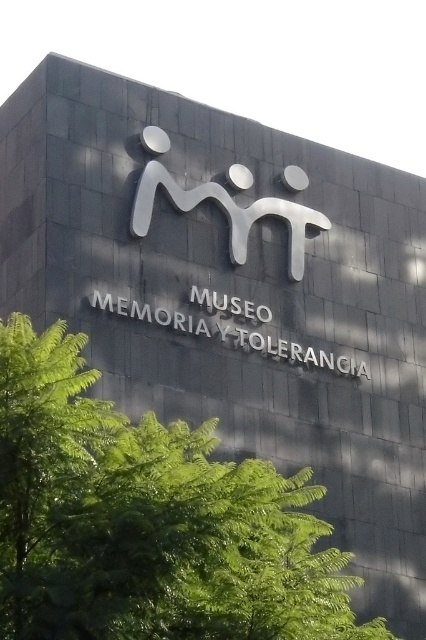
You are standing in front of the building and notice two points marked on the facade. The first point is at coordinates point (137, 518) and the second is at point (137, 221). Which point is closer to you?

Point (137, 518) is closer to the viewer than point (137, 221).

You are a photographer planning to take a picture of the sleek silver logo at center and the green leafy tree at center. Based on the scene, which object is wider?

The green leafy tree at center might be wider than sleek silver logo at center according to the description.